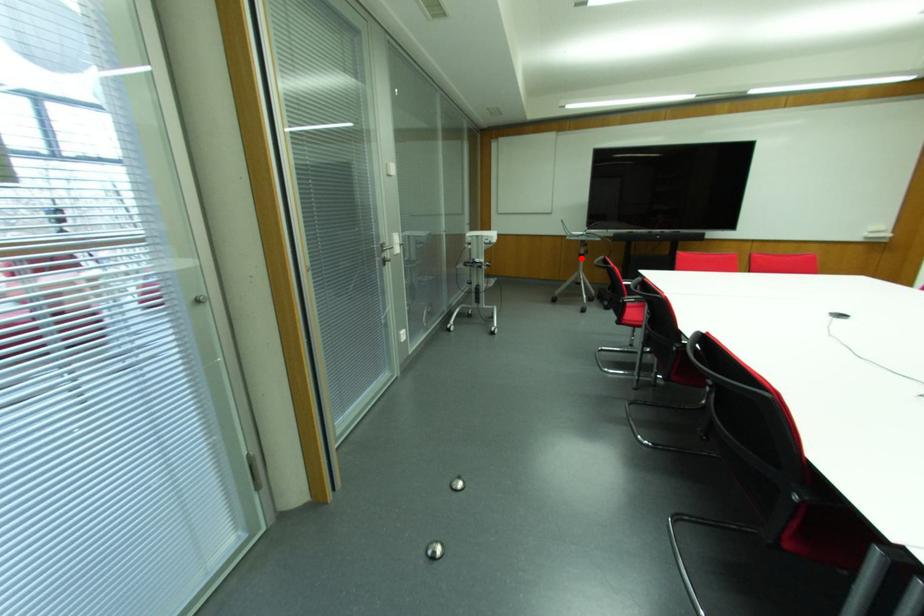
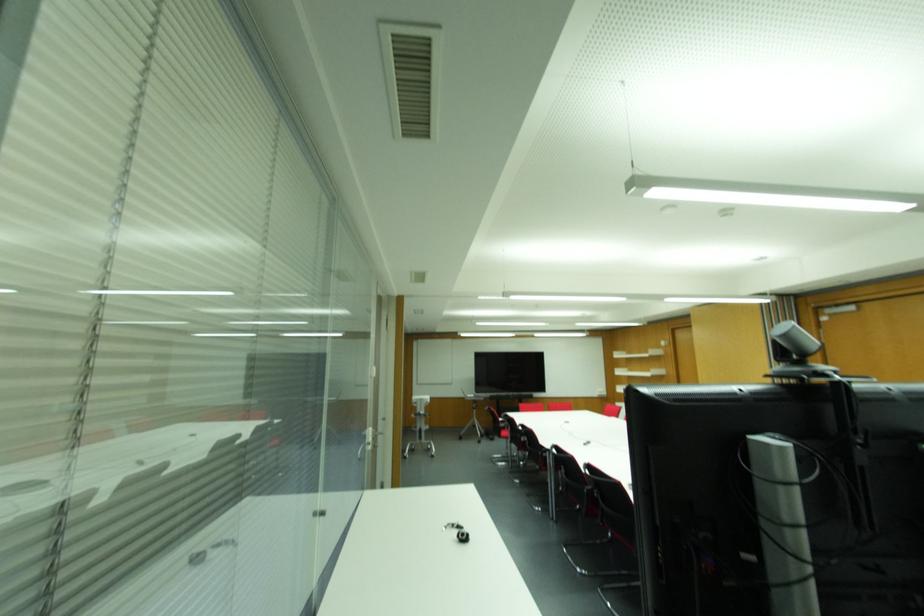
Locate, in the second image, the point that corresponds to the highlighted location in the first image.

(473, 410)